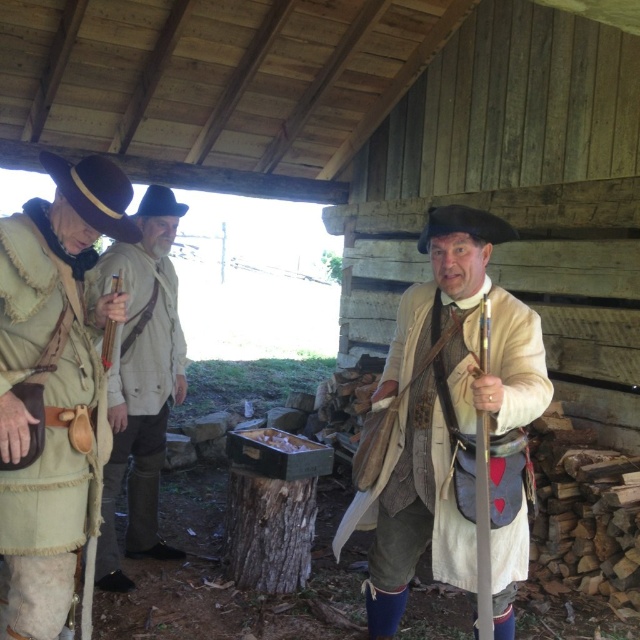
Based on the scene described, which clothing item at the center is shorter in length between the light beige fabric coat at center and the light brown leather jacket at center?

The light beige fabric coat at center is shorter than the light brown leather jacket at center according to the description.

You are a costume designer preparing for a historical play. You have two items from the scene to place on a display rack. The leather belt at left and the light brown leather jacket at center. Which item will take up more space on the rack?

The light brown leather jacket at center will take up more space on the rack because the leather belt at left occupies less space than the light brown leather jacket at center.

You are a costume designer preparing for a historical play. You have two costumes at the center of your collection, the light beige fabric coat at center and the light brown leather jacket at center. Which costume takes up more physical space when laid out flat?

The light brown leather jacket at center takes up more physical space when laid out flat because the light beige fabric coat at center occupies less space than it.